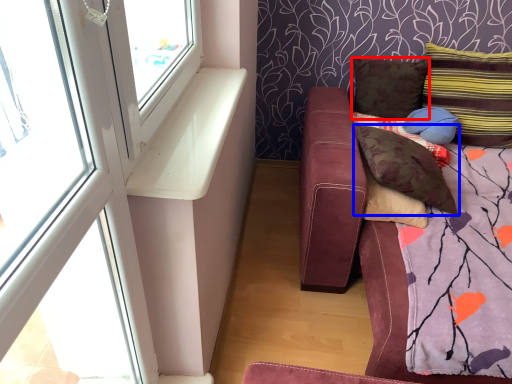
Question: Which point is further to the camera, pillow (highlighted by a red box) or pillow (highlighted by a blue box)?

Choices:
 (A) pillow
 (B) pillow

Answer: (A)